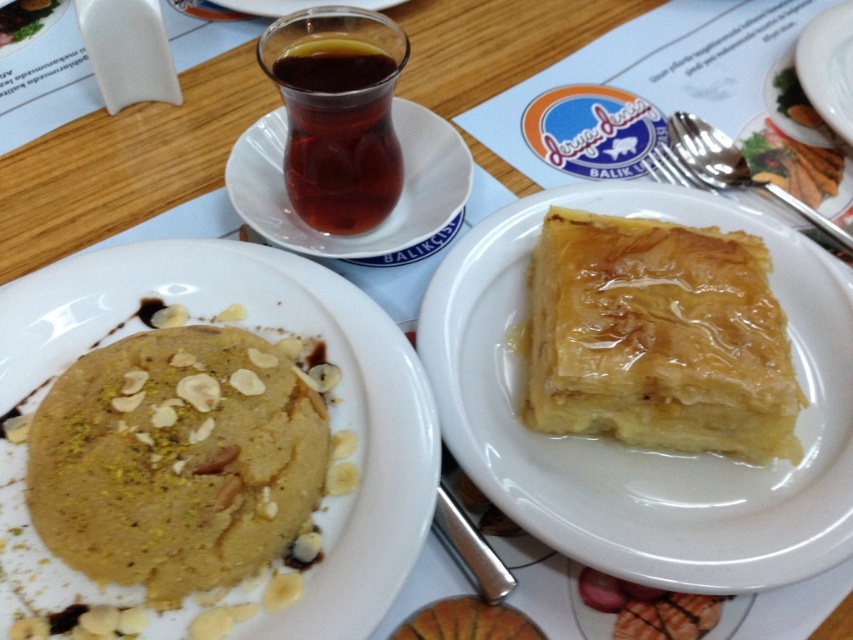
You are a food critic evaluating the presentation of this table setting. The transparent glass cup at upper center and the white glossy plate at upper center are both part of the setup. Which of these two items is shorter in height?

The transparent glass cup at upper center has a lesser height compared to the white glossy plate at upper center, so the transparent glass cup at upper center is shorter in height.

What is located at the point with coordinates (637, 449) on the image?

The point with coordinates (637, 449) corresponds to the golden flaky baklava at center.

Looking at this image, you are at a restaurant and want to pour the tea from the transparent glass cup at upper center into the white glossy plate at upper center. Is the plate large enough to hold the tea without spilling?

The transparent glass cup at upper center has a larger size compared to the white glossy plate at upper center. Since the cup is larger, pouring its contents into the plate might cause overflow or spillage due to the plate being smaller in size.